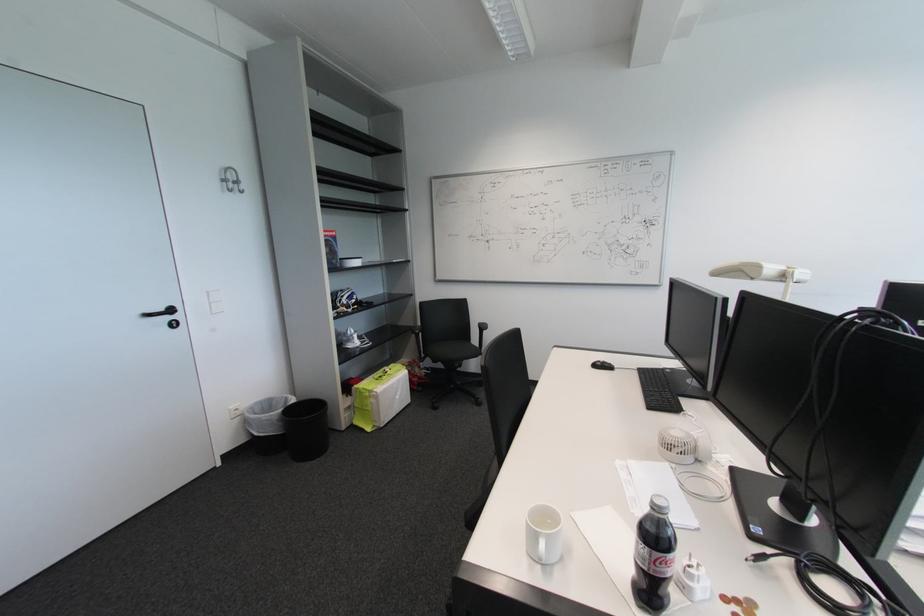
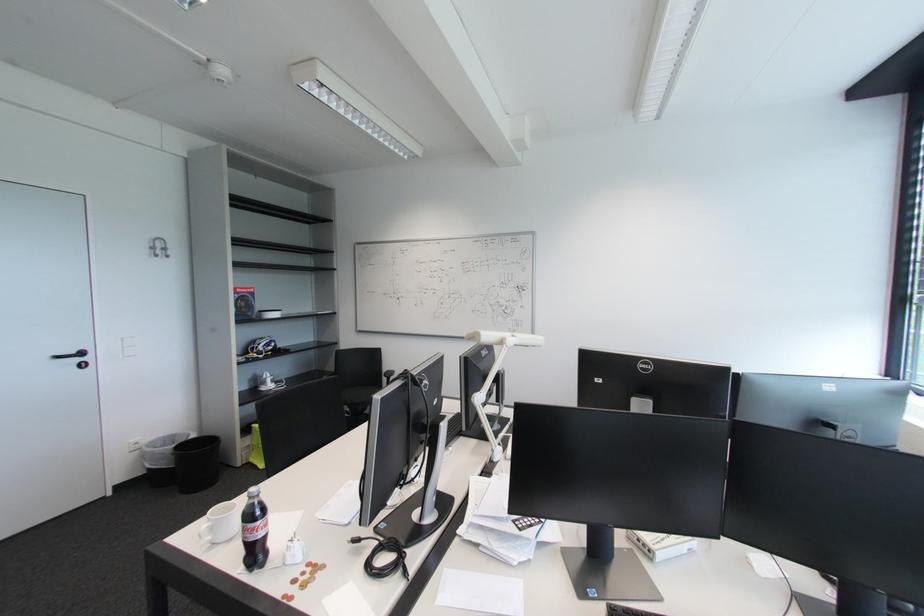
Locate, in the second image, the point that corresponds to [231,182] in the first image.

(159, 249)